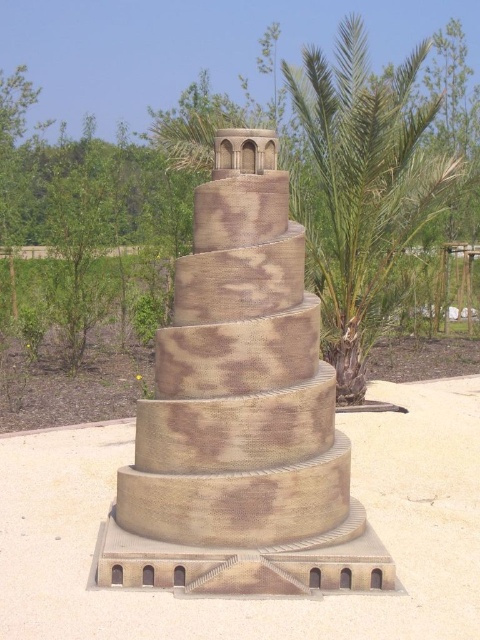
Which of these two, sandstone tower at center or green leafy palm tree at upper right, stands taller?

sandstone tower at center is taller.

Does sandstone tower at center appear on the right side of green leafy palm tree at upper right?

No, sandstone tower at center is not to the right of green leafy palm tree at upper right.

Locate an element on the screen. sandstone tower at center is located at coordinates (240, 413).

Does point (283, 232) come behind point (4, 531)?

No.

From the picture: Can you confirm if sandstone tower at center is positioned to the right of beige textured sand at center?

Indeed, sandstone tower at center is positioned on the right side of beige textured sand at center.

The image size is (480, 640). Identify the location of sandstone tower at center. (240, 413).

Does beige textured sand at center appear on the left side of green leafy palm tree at upper right?

Correct, you'll find beige textured sand at center to the left of green leafy palm tree at upper right.

Can you confirm if beige textured sand at center is wider than green leafy palm tree at upper right?

Indeed, beige textured sand at center has a greater width compared to green leafy palm tree at upper right.

Is point (24, 435) behind point (343, 400)?

No, (24, 435) is in front of (343, 400).

At what (x,y) coordinates should I click in order to perform the action: click on beige textured sand at center. Please return your answer as a coordinate pair (x, y). This screenshot has width=480, height=640. Looking at the image, I should click on (254, 596).